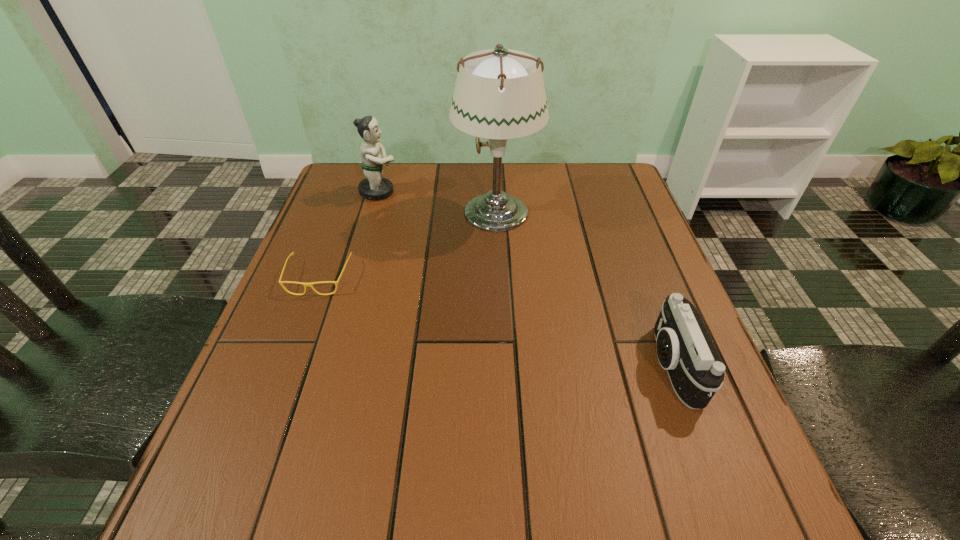
Find the location of a particular element. the tallest object is located at coordinates (499, 94).

Find the location of a particular element. This screenshot has height=540, width=960. the second object from right to left is located at coordinates (499, 94).

This screenshot has height=540, width=960. What are the coordinates of `figurine` in the screenshot? It's located at (374, 187).

The image size is (960, 540). I want to click on the second shortest object, so click(x=684, y=348).

The image size is (960, 540). Find the location of `camera`. camera is located at coordinates (684, 348).

You are a GUI agent. You are given a task and a screenshot of the screen. Output one action in this format:
    pyautogui.click(x=<x>, y=<y>)
    Task: Click on the third farthest object
    The image size is (960, 540).
    Given the screenshot: What is the action you would take?
    pyautogui.click(x=280, y=282)

Find the location of a particular element. The height and width of the screenshot is (540, 960). the shortest object is located at coordinates (280, 282).

The width and height of the screenshot is (960, 540). Find the location of `free point located 0.170m on the lampshade of the second object from right to left`. free point located 0.170m on the lampshade of the second object from right to left is located at coordinates (389, 211).

Locate an element on the screen. blank area located on the lampshade of the second object from right to left is located at coordinates point(371,211).

The image size is (960, 540). I want to click on vacant region located on the lampshade of the second object from right to left, so coord(385,211).